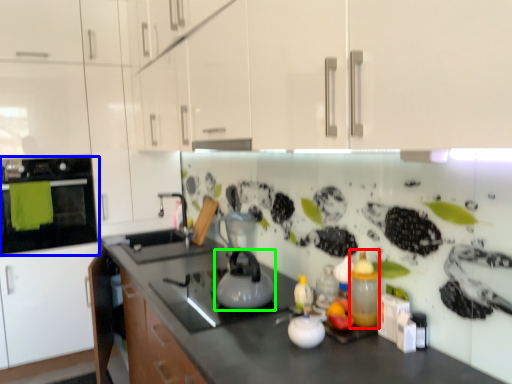
Question: Estimate the real-world distances between objects in this image. Which object is farther from bottle (highlighted by a red box), home appliance (highlighted by a blue box) or kitchen appliance (highlighted by a green box)?

Choices:
 (A) home appliance
 (B) kitchen appliance

Answer: (A)